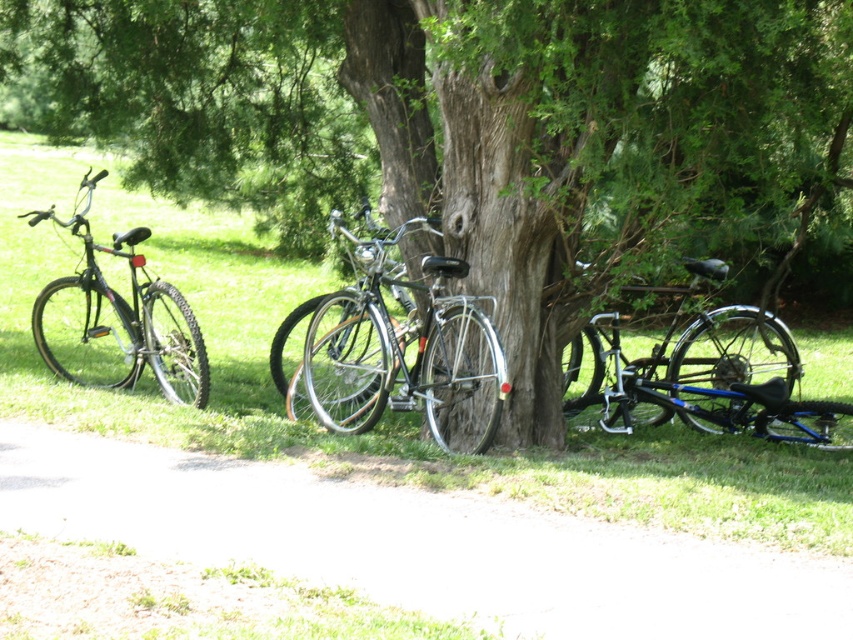
Question: Which of the following is the farthest from the observer?

Choices:
 (A) 427,260
 (B) 157,346
 (C) 753,378
 (D) 451,83

Answer: (C)

Question: Among these objects, which one is nearest to the camera?

Choices:
 (A) matte black bicycle at left
 (B) shiny silver bicycle at center
 (C) blue metallic bicycle at right
 (D) green textured tree at center

Answer: (D)

Question: Which point is closer to the camera?

Choices:
 (A) (766, 72)
 (B) (769, 408)
 (C) (347, 390)

Answer: (A)

Question: Where is blue metallic bicycle at right located in relation to matte black bicycle at left in the image?

Choices:
 (A) above
 (B) below

Answer: (B)

Question: Is blue metallic bicycle at right below matte black bicycle at left?

Choices:
 (A) no
 (B) yes

Answer: (B)

Question: Does green textured tree at center have a lesser width compared to shiny silver bicycle at center?

Choices:
 (A) yes
 (B) no

Answer: (B)